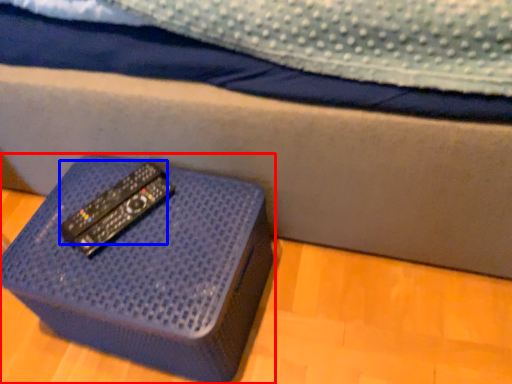
Question: Which object appears closest to the camera in this image, furniture (highlighted by a red box) or remote (highlighted by a blue box)?

Choices:
 (A) furniture
 (B) remote

Answer: (A)